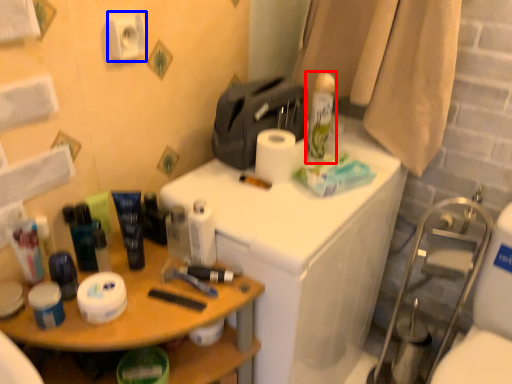
Question: Which object is further to the camera taking this photo, shaving cream (highlighted by a red box) or toilet paper (highlighted by a blue box)?

Choices:
 (A) shaving cream
 (B) toilet paper

Answer: (A)